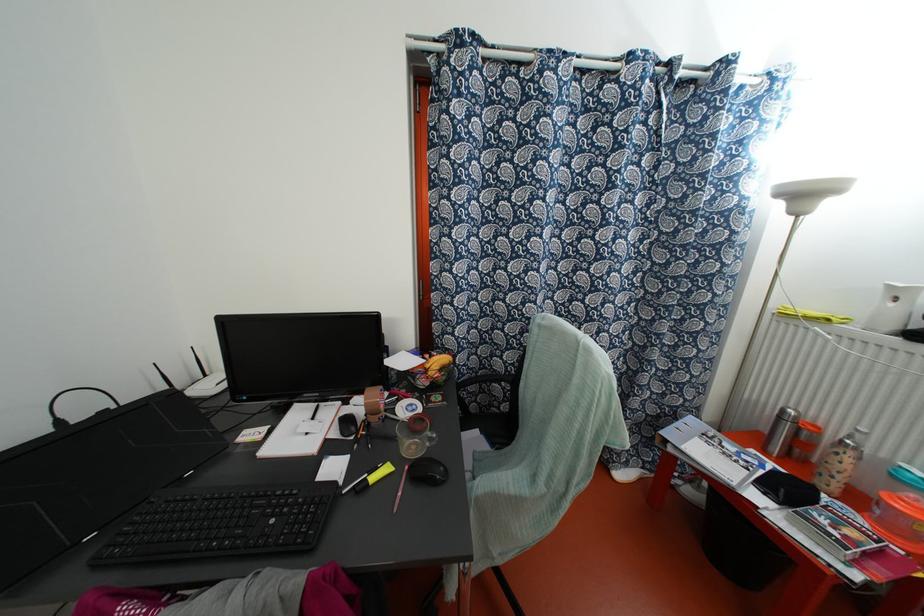
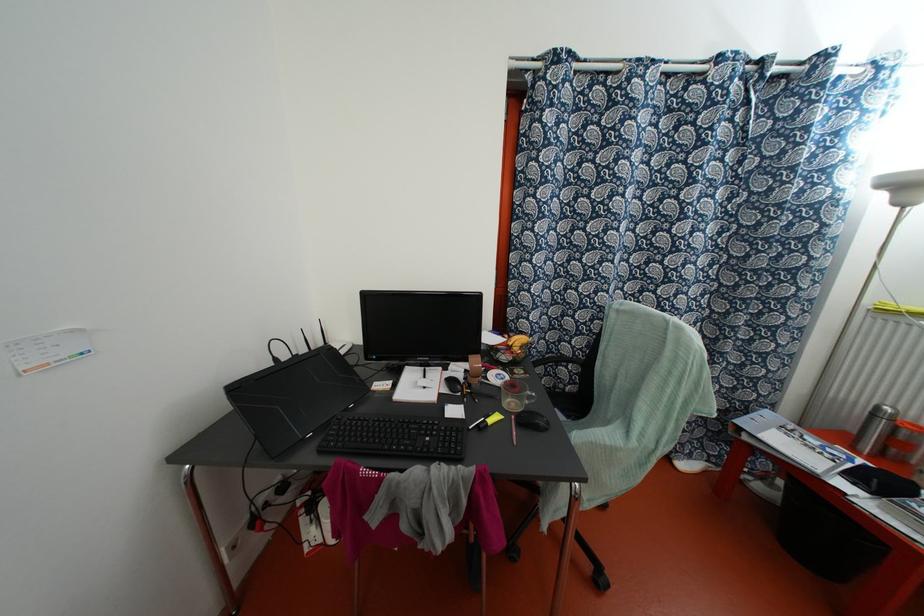
Where in the second image is the point corresponding to pixel 430 439 from the first image?

(529, 397)